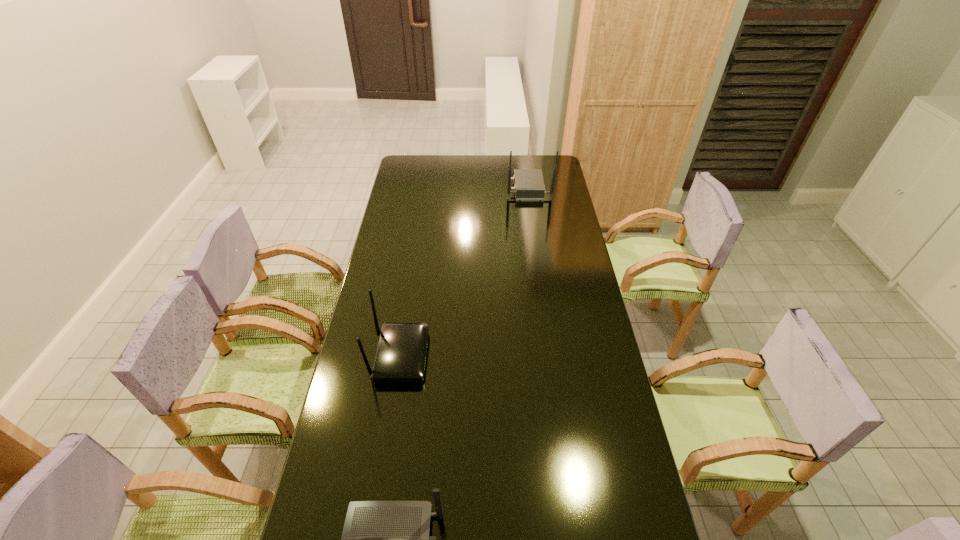
Locate an element on the screen. router object that ranks as the second closest to the second nearest router is located at coordinates (529, 186).

Point out which router is positioned as the nearest to the tallest router. Please provide its 2D coordinates. Your answer should be formatted as a tuple, i.e. [(x, y)], where the tuple contains the x and y coordinates of a point satisfying the conditions above.

[(401, 353)]